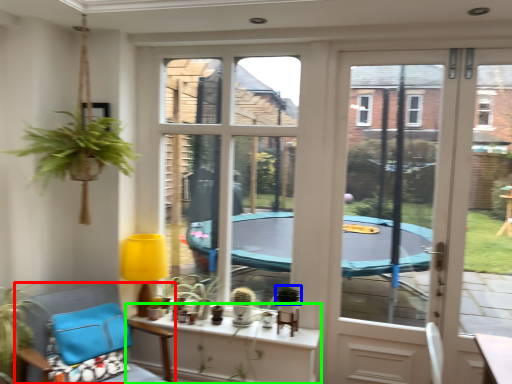
Question: Based on their relative distances, which object is nearer to chair (highlighted by a red box)? Choose from plant (highlighted by a blue box) and window (highlighted by a green box).

Choices:
 (A) plant
 (B) window

Answer: (B)